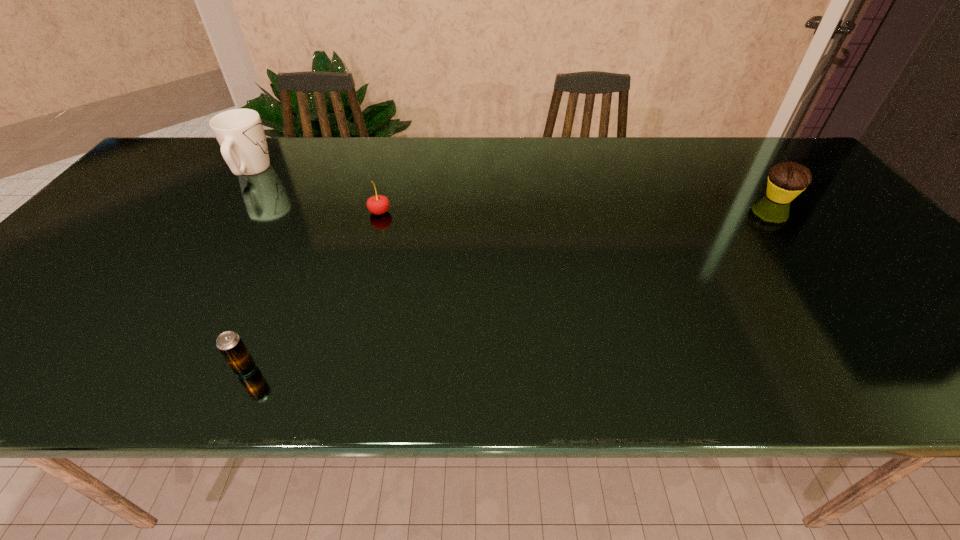
Locate an element on the screen. free space between the cherry and the third object from right to left is located at coordinates (313, 291).

Image resolution: width=960 pixels, height=540 pixels. In order to click on vacant space that is in between the mug and the cherry in this screenshot , I will do `click(315, 192)`.

Where is `free spot between the beer can and the rightmost object`? The height and width of the screenshot is (540, 960). free spot between the beer can and the rightmost object is located at coordinates (x=512, y=283).

You are a GUI agent. You are given a task and a screenshot of the screen. Output one action in this format:
    pyautogui.click(x=<x>, y=<y>)
    Task: Click on the free space between the muffin and the nearest object
    This screenshot has height=540, width=960.
    Given the screenshot: What is the action you would take?
    pyautogui.click(x=512, y=283)

At what (x,y) coordinates should I click in order to perform the action: click on empty location between the second object from right to left and the beer can. Please return your answer as a coordinate pair (x, y). This screenshot has width=960, height=540. Looking at the image, I should click on (313, 291).

I want to click on free point between the nearest object and the mug, so click(249, 270).

This screenshot has height=540, width=960. I want to click on vacant space that is in between the muffin and the tallest object, so click(x=515, y=184).

Where is `free spot between the muffin and the mug`? The height and width of the screenshot is (540, 960). free spot between the muffin and the mug is located at coordinates (515, 184).

Locate an element on the screen. The width and height of the screenshot is (960, 540). the second closest object to the nearest object is located at coordinates (240, 133).

Where is `object that ranks as the closest to the muffin`? This screenshot has width=960, height=540. object that ranks as the closest to the muffin is located at coordinates (378, 204).